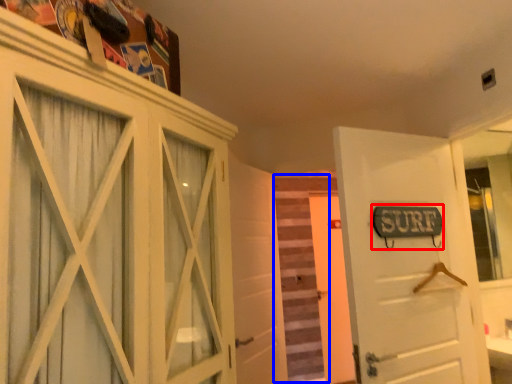
Question: Among these objects, which one is nearest to the camera, street sign (highlighted by a red box) or stair (highlighted by a blue box)?

Choices:
 (A) street sign
 (B) stair

Answer: (A)